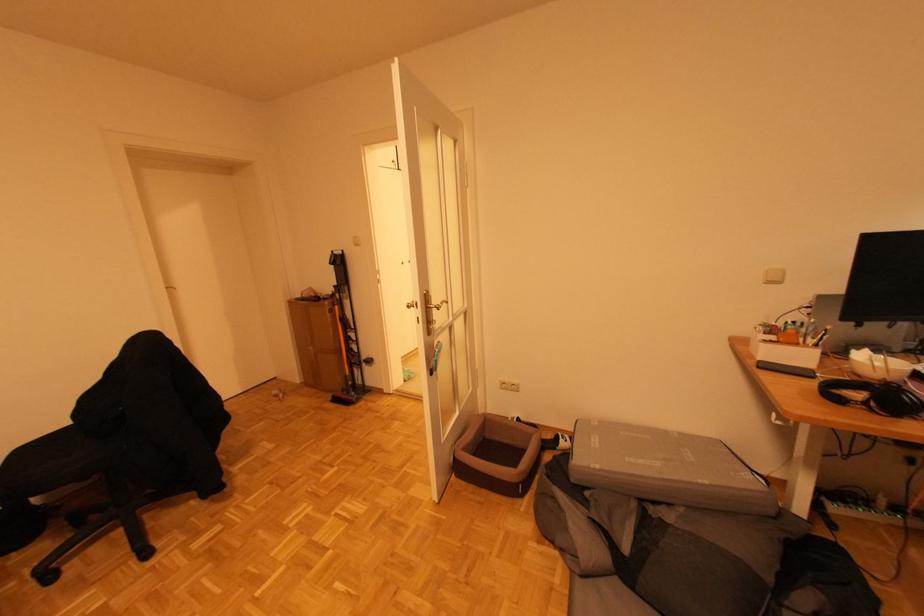
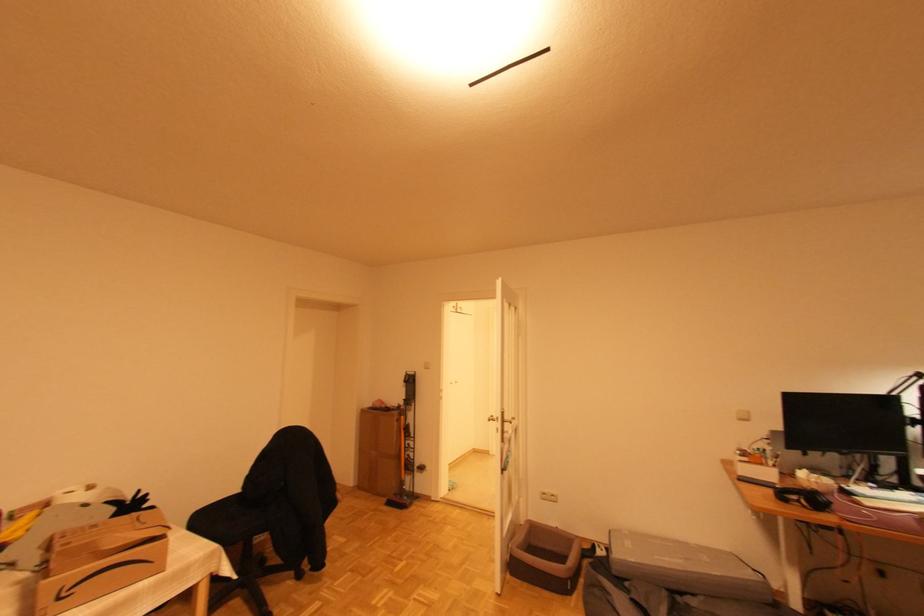
Where in the second image is the point corresponding to [506,384] from the first image?

(546, 495)